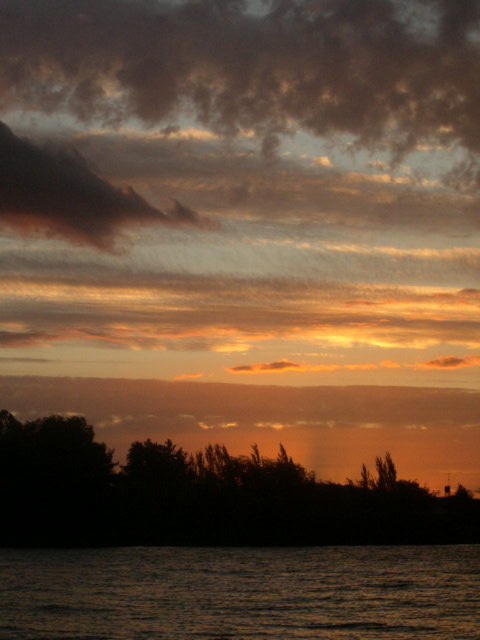
Question: Which of the following is the farthest from the observer?

Choices:
 (A) dark green leafy trees at lower center
 (B) dark water at bottom

Answer: (A)

Question: Is dark water at bottom positioned in front of dark green leafy trees at lower center?

Choices:
 (A) no
 (B) yes

Answer: (B)

Question: Which point appears closest to the camera in this image?

Choices:
 (A) (467, 579)
 (B) (423, 508)

Answer: (A)

Question: Is dark water at bottom below dark green leafy trees at lower center?

Choices:
 (A) yes
 (B) no

Answer: (A)

Question: Which of the following is the closest to the observer?

Choices:
 (A) (364, 620)
 (B) (31, 516)

Answer: (A)

Question: Is dark water at bottom smaller than dark green leafy trees at lower center?

Choices:
 (A) yes
 (B) no

Answer: (B)